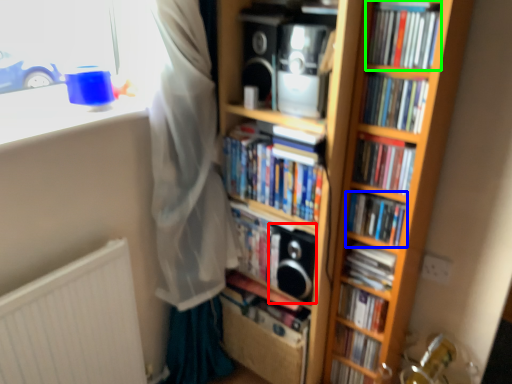
Question: Considering the real-world distances, which object is farthest from speaker (highlighted by a red box)? book (highlighted by a blue box) or book (highlighted by a green box)?

Choices:
 (A) book
 (B) book

Answer: (B)